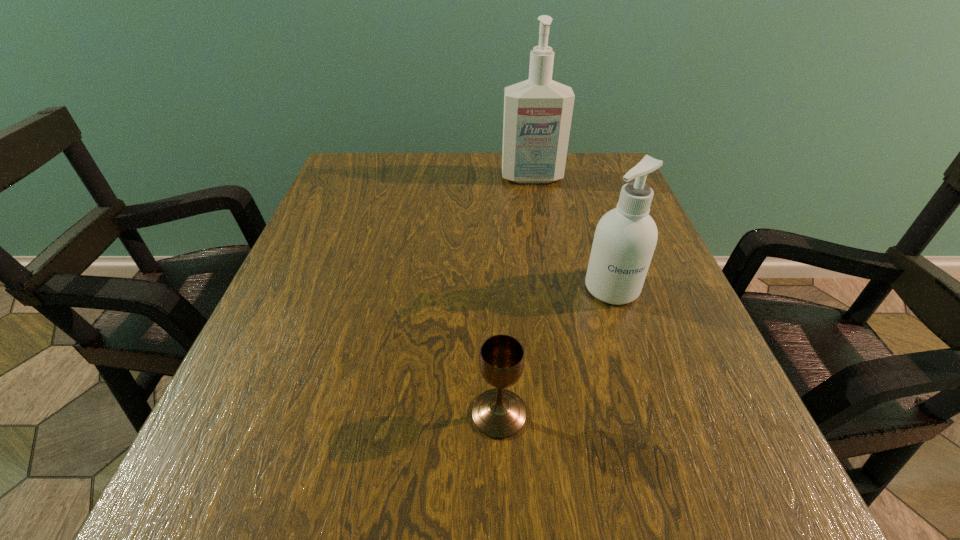
Find the location of `object located at the far right corner`. object located at the far right corner is located at coordinates (538, 112).

In the image, there is a desktop. Identify the location of free space at the far edge. This screenshot has height=540, width=960. (481, 183).

You are a GUI agent. You are given a task and a screenshot of the screen. Output one action in this format:
    pyautogui.click(x=<x>, y=<y>)
    Task: Click on the vacant region at the left edge of the desktop
    The height and width of the screenshot is (540, 960).
    Given the screenshot: What is the action you would take?
    pyautogui.click(x=305, y=323)

The image size is (960, 540). Find the location of `free space at the right edge of the desktop`. free space at the right edge of the desktop is located at coordinates [640, 323].

The width and height of the screenshot is (960, 540). What are the coordinates of `free space at the far left corner` in the screenshot? It's located at (366, 163).

Where is `free area in between the nearest object and the second tallest object`? This screenshot has width=960, height=540. free area in between the nearest object and the second tallest object is located at coordinates (556, 351).

Locate an element on the screen. free point between the chalice and the shorter cleansing agent is located at coordinates (556, 351).

Identify the location of free space between the nearer cleansing agent and the tallest object. This screenshot has height=540, width=960. (572, 233).

Where is `empty space between the shortest object and the second shortest object`? This screenshot has height=540, width=960. empty space between the shortest object and the second shortest object is located at coordinates tap(556, 351).

Locate an element on the screen. This screenshot has width=960, height=540. empty space between the shortest object and the tallest object is located at coordinates (516, 296).